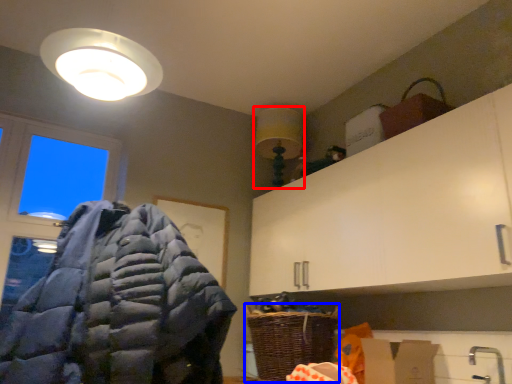
Question: Which object is closer to the camera taking this photo, light fixture (highlighted by a red box) or basket (highlighted by a blue box)?

Choices:
 (A) light fixture
 (B) basket

Answer: (B)